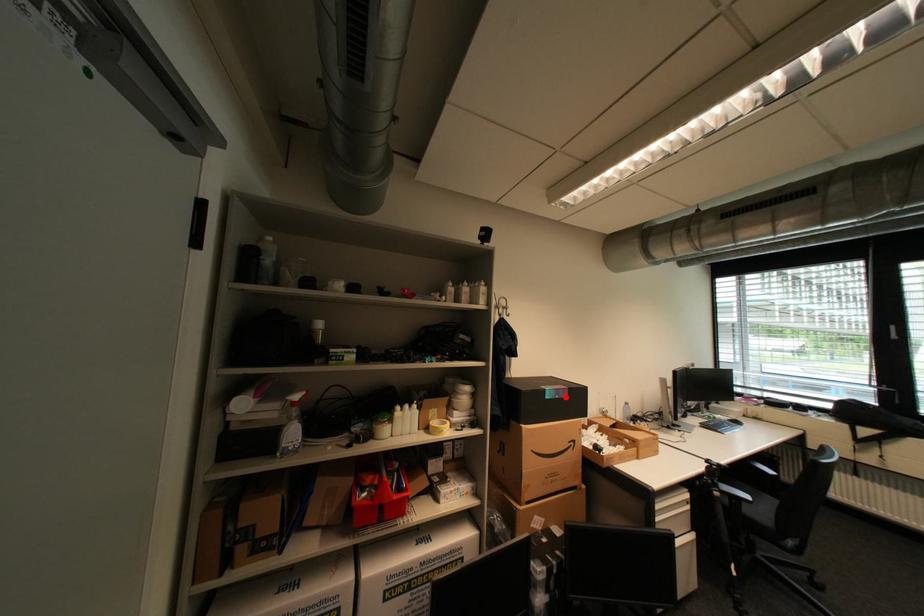
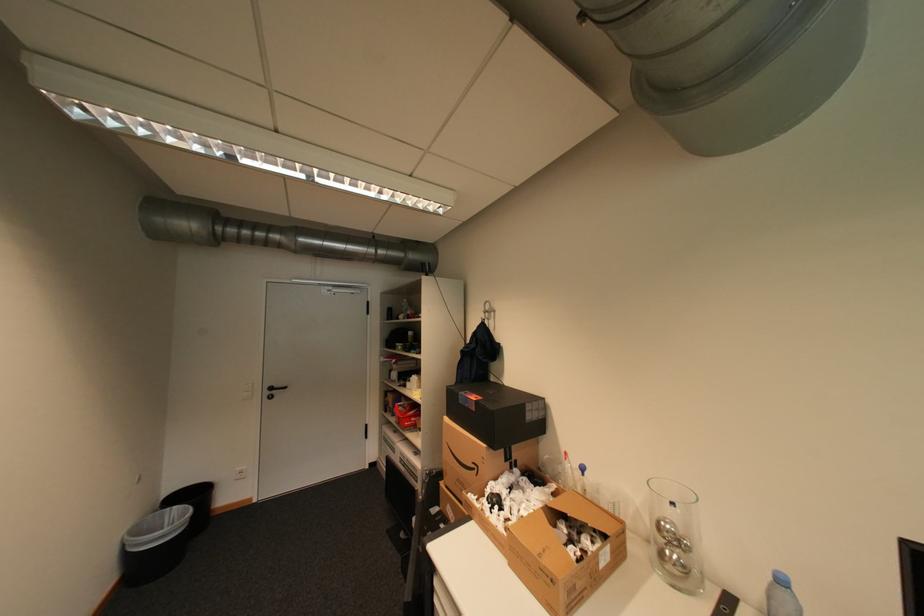
In the second image, find the point that corresponds to the highlighted location in the first image.

(476, 406)